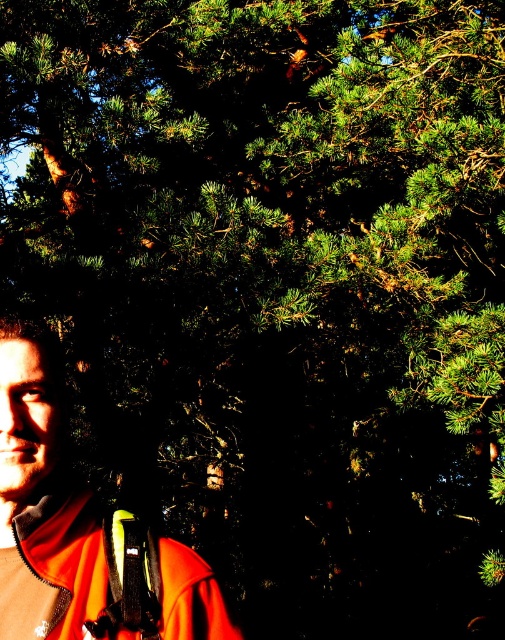
You are a photographer trying to capture a detailed shot of the orange fleece jacket at lower left and the black matte strap at lower left. Since the lighting is so contrasty, you want to ensure both items are well lit. Which object should you adjust your camera focus on first to ensure it stays in the frame while you adjust the lighting?

The orange fleece jacket at lower left is in front of the black matte strap at lower left, so you should focus on the orange fleece jacket at lower left first to keep it in the frame while adjusting the lighting.

You are a photographer trying to capture the orange fleece jacket at lower left and the black matte strap at lower left in a single frame. Based on their positions, which object should you focus on first to ensure both are in the same shot?

The orange fleece jacket at lower left is located below the black matte strap at lower left, so you should focus on the black matte strap at lower left first to ensure both are in the frame.